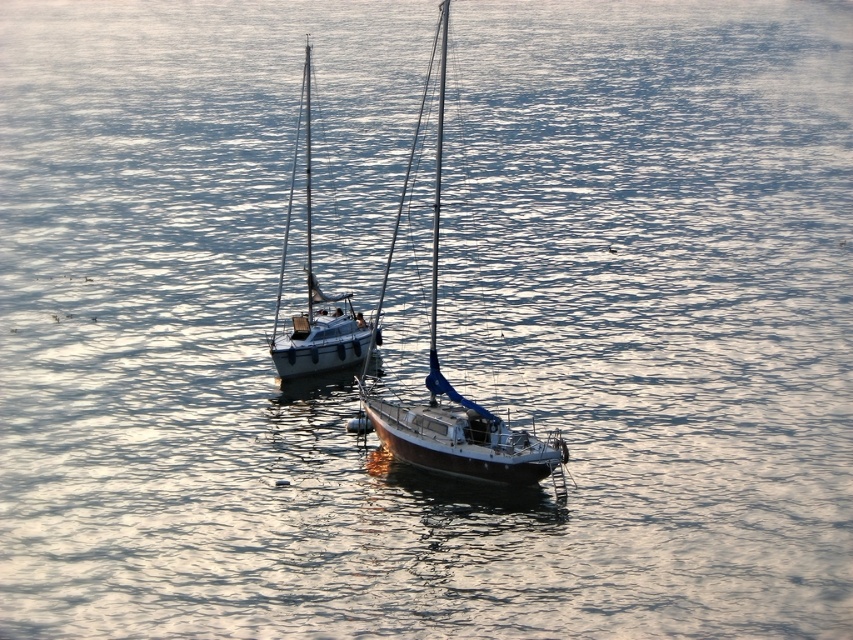
Is point (306, 74) positioned behind point (437, 257)?

Yes, it is.

Is white glossy sailboat at center thinner than blue glossy mast at center?

In fact, white glossy sailboat at center might be wider than blue glossy mast at center.

Between point (302, 330) and point (430, 307), which one is positioned in front?

Point (302, 330) is more forward.

Where is `white glossy sailboat at center`? The height and width of the screenshot is (640, 853). white glossy sailboat at center is located at coordinates (318, 304).

Between point (448, 472) and point (436, 288), which one is positioned in front?

Point (448, 472) is more forward.

Can you confirm if wooden sailboat at center is positioned above blue glossy mast at center?

Correct, wooden sailboat at center is located above blue glossy mast at center.

Describe the element at coordinates (457, 396) in the screenshot. I see `wooden sailboat at center` at that location.

The width and height of the screenshot is (853, 640). Find the location of `wooden sailboat at center`. wooden sailboat at center is located at coordinates (457, 396).

Can you confirm if wooden sailboat at center is shorter than white glossy sailboat at center?

In fact, wooden sailboat at center may be taller than white glossy sailboat at center.

From the picture: Can you confirm if wooden sailboat at center is thinner than white glossy sailboat at center?

Yes, wooden sailboat at center is thinner than white glossy sailboat at center.

This screenshot has width=853, height=640. I want to click on wooden sailboat at center, so click(457, 396).

You are a GUI agent. You are given a task and a screenshot of the screen. Output one action in this format:
    pyautogui.click(x=<x>, y=<y>)
    Task: Click on the wooden sailboat at center
    The width and height of the screenshot is (853, 640).
    Given the screenshot: What is the action you would take?
    pyautogui.click(x=457, y=396)